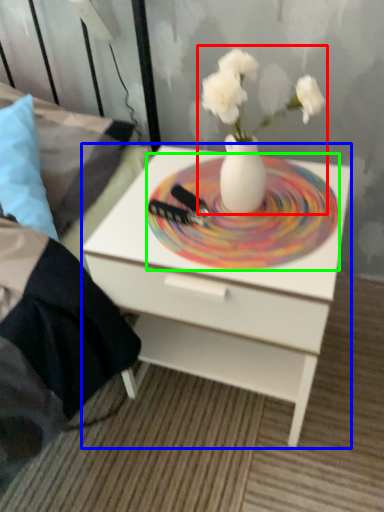
Question: Considering the real-world distances, which object is farthest from floral arrangement (highlighted by a red box)? nightstand (highlighted by a blue box) or plate (highlighted by a green box)?

Choices:
 (A) nightstand
 (B) plate

Answer: (A)